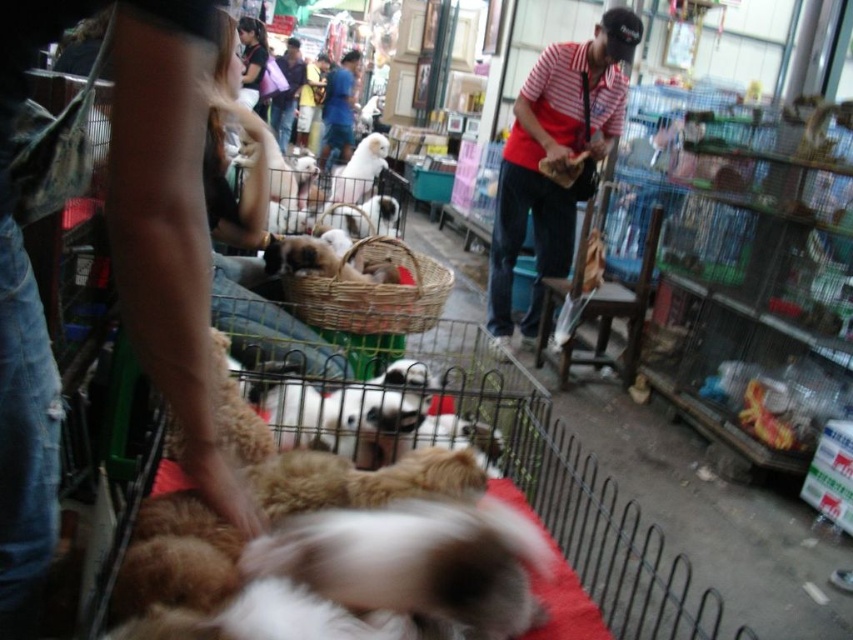
You are a customer at the pet market looking to adopt a dog. You notice the brown fur dog at lower left and the red striped shirt at center. Which of these two items is smaller in size?

The brown fur dog at lower left is smaller in size compared to the red striped shirt at center.

You are a customer at the pet market looking to adopt a dog. You notice the fluffy brown dog at center and the dark blue shirt at center. Which item is taller?

The dark blue shirt at center is taller than the fluffy brown dog at center.

You are a customer at the pet market looking to adopt a dog. You notice the brown fur dog at lower left and the dark blue shirt at center. Based on their positions, which one is located to the right of the other?

The brown fur dog at lower left is to the right of the dark blue shirt at center.